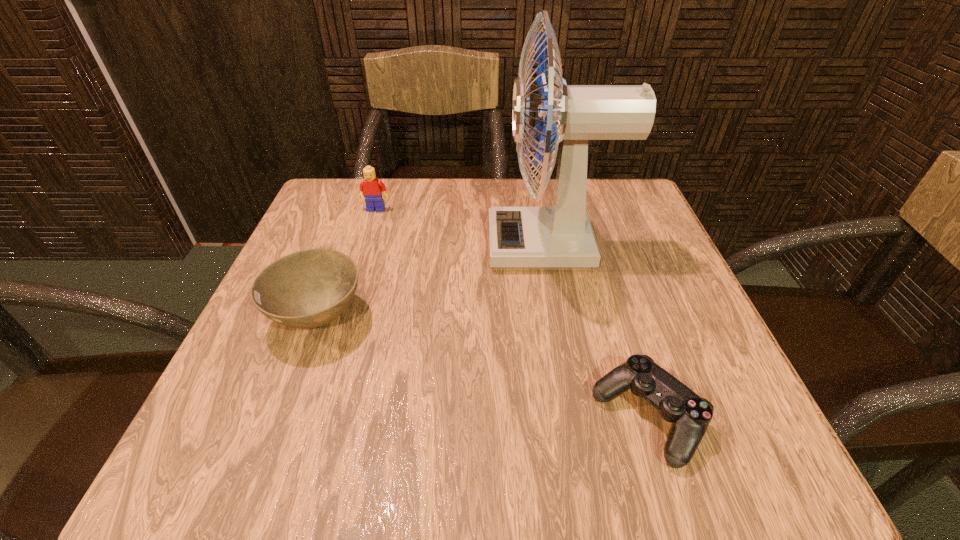
Identify the location of object located at the near right corner. (690, 414).

Where is `vacant space at the far edge of the desktop`? The image size is (960, 540). vacant space at the far edge of the desktop is located at coordinates (431, 192).

Identify the location of vacant area at the near edge of the desktop. (466, 465).

Where is `vacant space at the left edge`? vacant space at the left edge is located at coordinates (305, 338).

In the image, there is a desktop. Identify the location of vacant space at the right edge. (665, 294).

The image size is (960, 540). In the image, there is a desktop. What are the coordinates of `vacant space at the far left corner` in the screenshot? It's located at (343, 186).

The height and width of the screenshot is (540, 960). Identify the location of vacant space at the far right corner. (594, 221).

Where is `vacant space at the near right corner`? vacant space at the near right corner is located at coordinates (709, 450).

Identify the location of vacant space that's between the tallest object and the shortest object. This screenshot has width=960, height=540. (599, 332).

At what (x,y) coordinates should I click in order to perform the action: click on vacant region between the Lego and the fan. Please return your answer as a coordinate pair (x, y). Looking at the image, I should click on (464, 228).